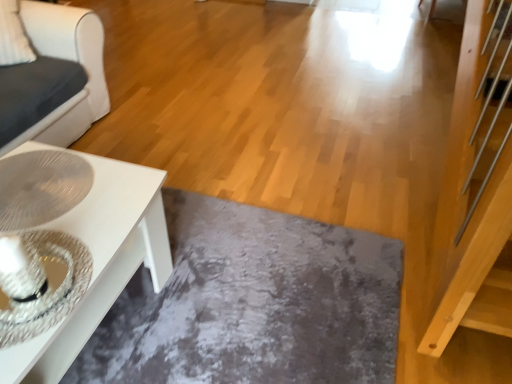
Locate an element on the screen. Image resolution: width=512 pixels, height=384 pixels. free spot below slate at lower center (from a real-world perspective) is located at coordinates (256, 287).